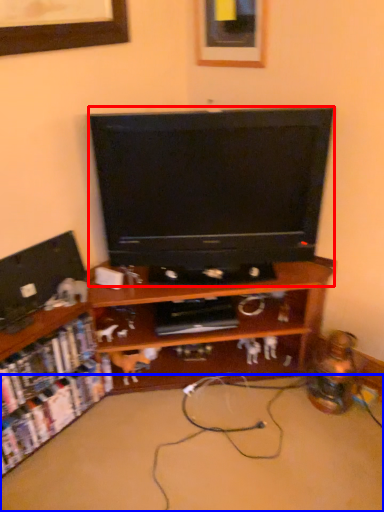
Question: Among these objects, which one is nearest to the camera, television (highlighted by a red box) or plain (highlighted by a blue box)?

Choices:
 (A) television
 (B) plain

Answer: (B)